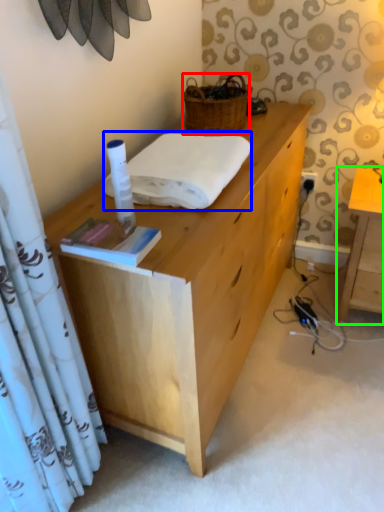
Question: Which object is the farthest from picnic basket (highlighted by a red box)? Choose among these: linen (highlighted by a blue box) or table (highlighted by a green box).

Choices:
 (A) linen
 (B) table

Answer: (B)